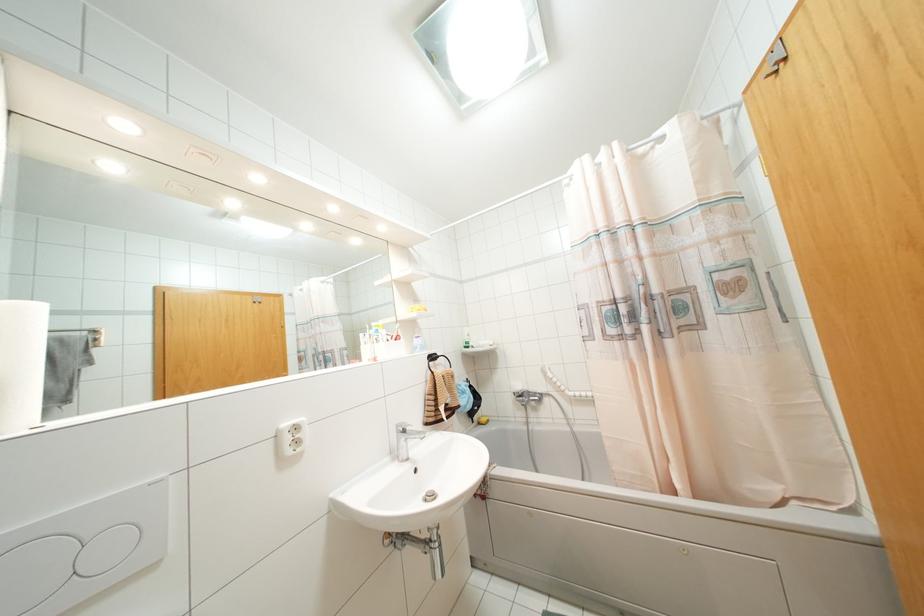
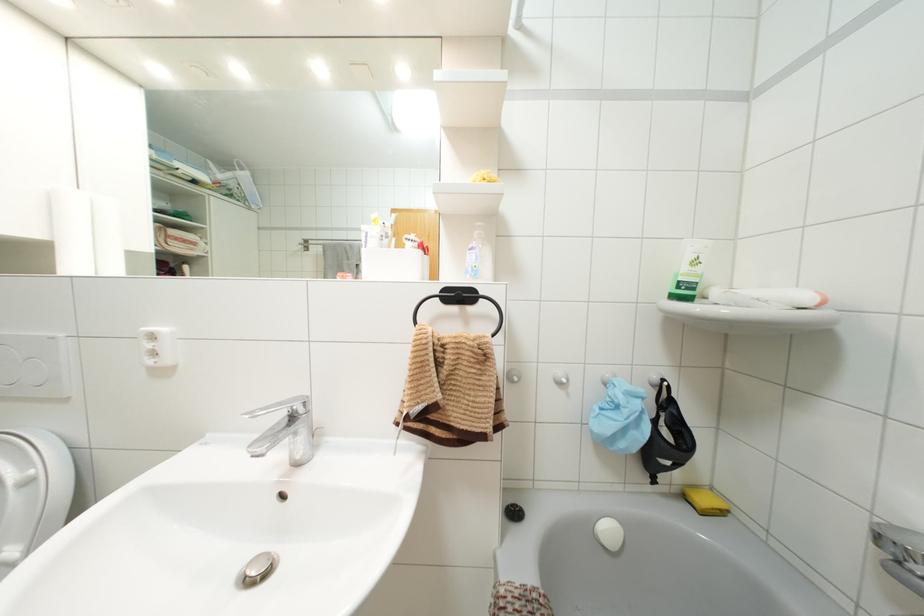
In the second image, find the point that corresponds to point 468,334 in the first image.

(695, 262)